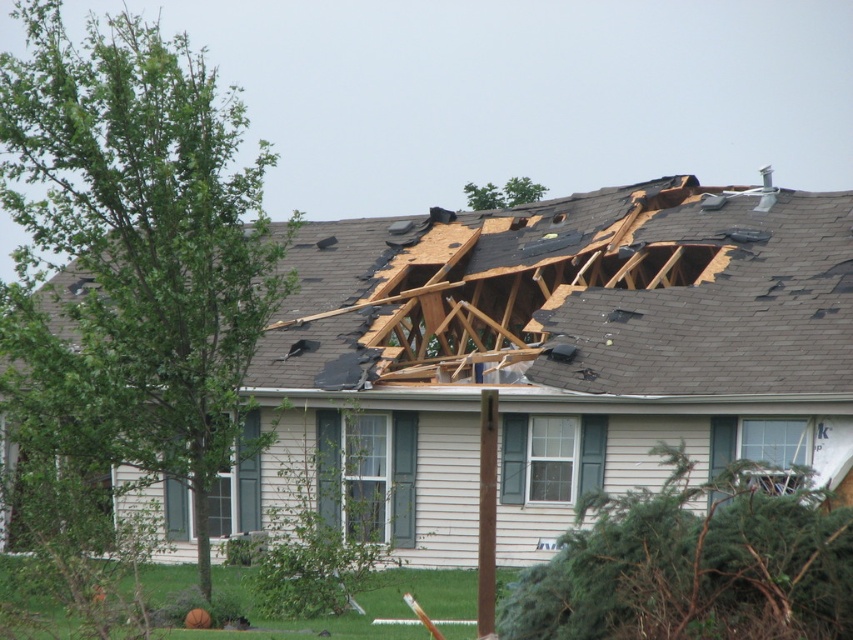
Question: Which of the following is the closest to the observer?

Choices:
 (A) (488, 568)
 (B) (674, 257)

Answer: (A)

Question: Which point is farther to the camera?

Choices:
 (A) (672, 336)
 (B) (488, 467)

Answer: (A)

Question: Which point is farther to the camera?

Choices:
 (A) brown wood pole at center
 (B) shiny gray shingles at upper center

Answer: (B)

Question: Is shiny gray shingles at upper center positioned behind brown wood pole at center?

Choices:
 (A) no
 (B) yes

Answer: (B)

Question: Is shiny gray shingles at upper center behind brown wood pole at center?

Choices:
 (A) no
 (B) yes

Answer: (B)

Question: Can you confirm if shiny gray shingles at upper center is positioned to the left of brown wood pole at center?

Choices:
 (A) no
 (B) yes

Answer: (A)